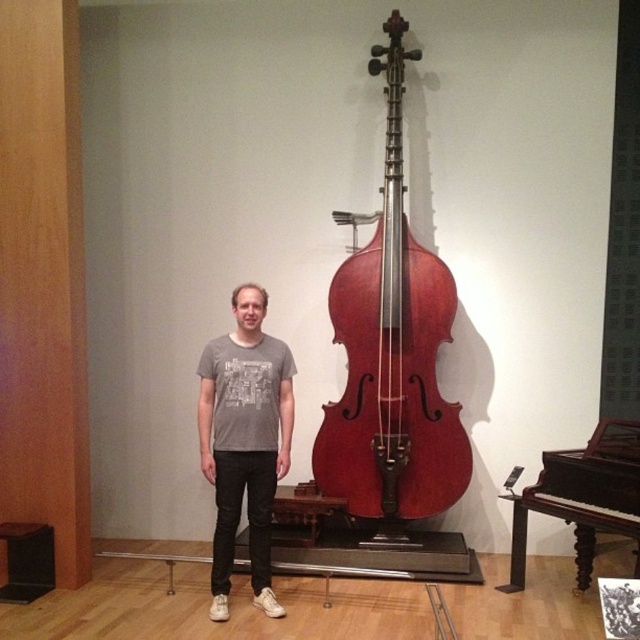
Measure the distance between shiny varnished violin at center and gray t-shirt at center.

They are 77.98 centimeters apart.

From the picture: Measure the distance between shiny varnished violin at center and gray t-shirt at center.

A distance of 30.70 inches exists between shiny varnished violin at center and gray t-shirt at center.

Is point (349, 376) positioned before point (234, 481)?

No, it is not.

Where is `shiny varnished violin at center`? This screenshot has height=640, width=640. shiny varnished violin at center is located at coordinates (392, 356).

Who is lower down, shiny varnished violin at center or black wood stool at lower left?

black wood stool at lower left

Who is more distant from viewer, (x=412, y=253) or (x=52, y=586)?

The point (x=412, y=253) is behind.

Which is in front, point (390, 35) or point (35, 525)?

Positioned in front is point (35, 525).

Find the location of a particular element. shiny varnished violin at center is located at coordinates (392, 356).

Consider the image. Is shiny varnished violin at center to the left of polished dark wood piano at lower right from the viewer's perspective?

Indeed, shiny varnished violin at center is positioned on the left side of polished dark wood piano at lower right.

Does point (435, 292) come farther from viewer compared to point (520, 561)?

Yes, point (435, 292) is behind point (520, 561).

Where is `shiny varnished violin at center`? shiny varnished violin at center is located at coordinates tap(392, 356).